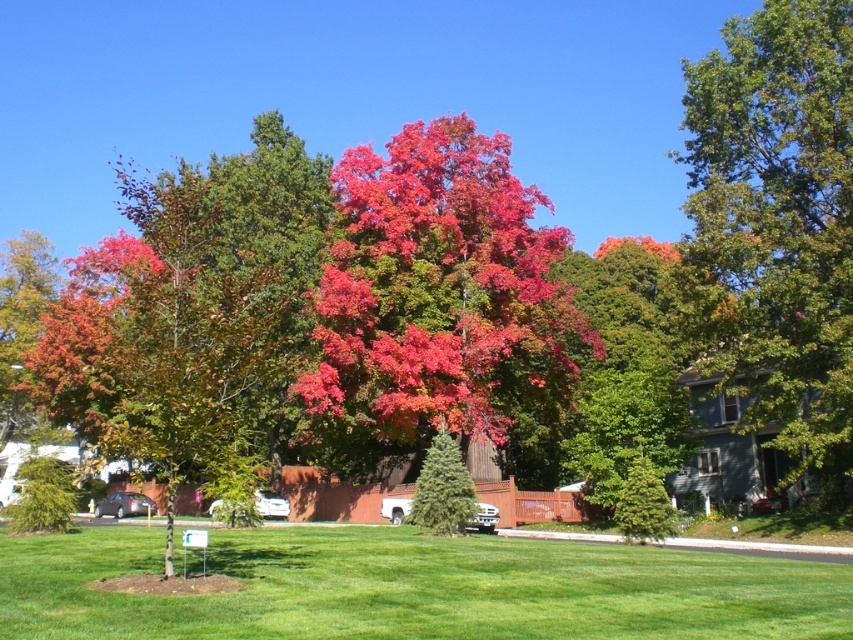
Can you confirm if bright red maple at center is thinner than green glossy tree at upper right?

No, bright red maple at center is not thinner than green glossy tree at upper right.

Which of these two, bright red maple at center or green glossy tree at upper right, stands taller?

bright red maple at center

Who is more distant from viewer, (503,225) or (759,61)?

The point (503,225) is more distant.

Where is `bright red maple at center`? bright red maple at center is located at coordinates (438, 291).

Between green grass at center and bright red maple at center, which one has less height?

green grass at center is shorter.

Is point (161, 529) more distant than point (436, 150)?

No.

Is point (466, 609) more distant than point (375, 266)?

No, it is not.

Find the location of a particular element. green grass at center is located at coordinates [x=415, y=588].

Who is more distant from viewer, (572, 362) or (468, 493)?

The point (572, 362) is more distant.

Based on the photo, can you confirm if bright red maple at center is positioned to the left of green textured evergreen tree at center?

No, bright red maple at center is not to the left of green textured evergreen tree at center.

The image size is (853, 640). What are the coordinates of `bright red maple at center` in the screenshot? It's located at (438, 291).